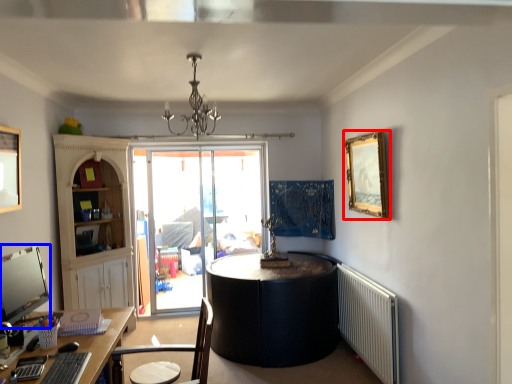
Question: Which point is closer to the camera, picture frame (highlighted by a red box) or computer monitor (highlighted by a blue box)?

Choices:
 (A) picture frame
 (B) computer monitor

Answer: (B)